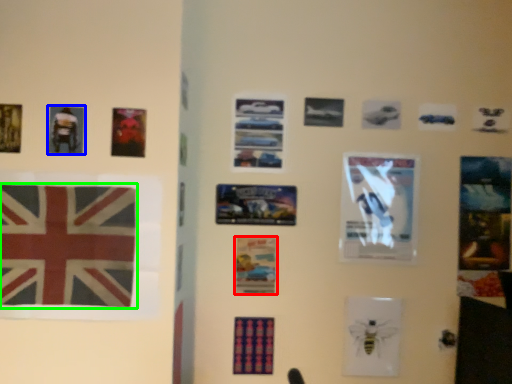
Question: Estimate the real-world distances between objects in this image. Which object is farther from poster (highlighted by a red box), poster (highlighted by a blue box) or flag (highlighted by a green box)?

Choices:
 (A) poster
 (B) flag

Answer: (A)